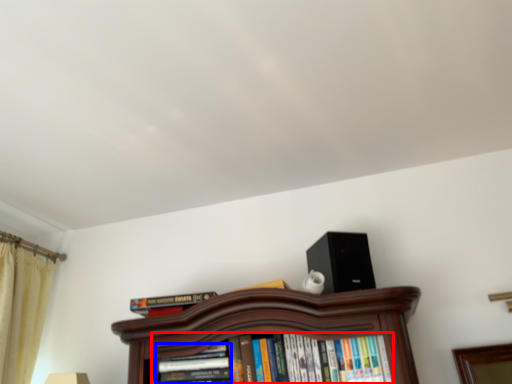
Question: Which point is closer to the camera, book (highlighted by a red box) or book (highlighted by a blue box)?

Choices:
 (A) book
 (B) book

Answer: (A)